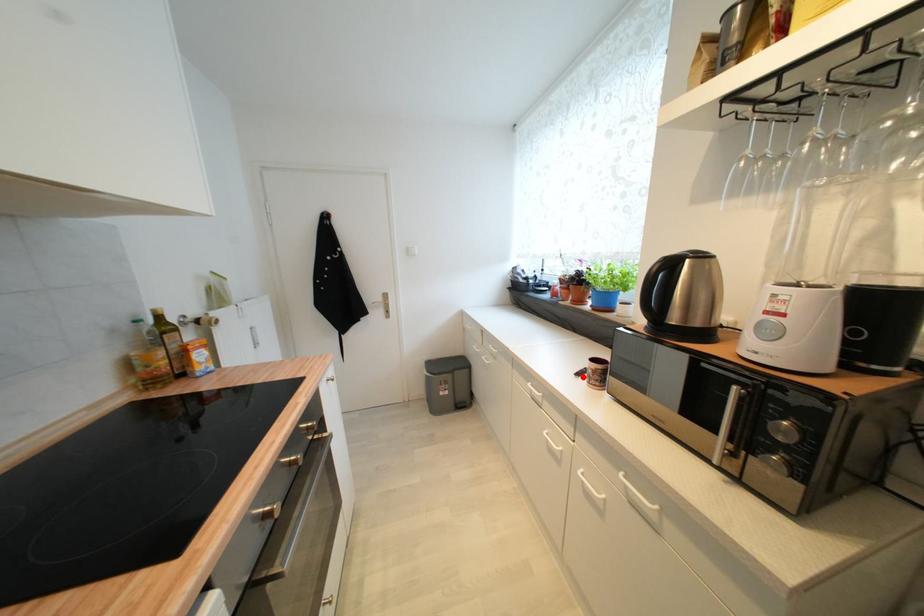
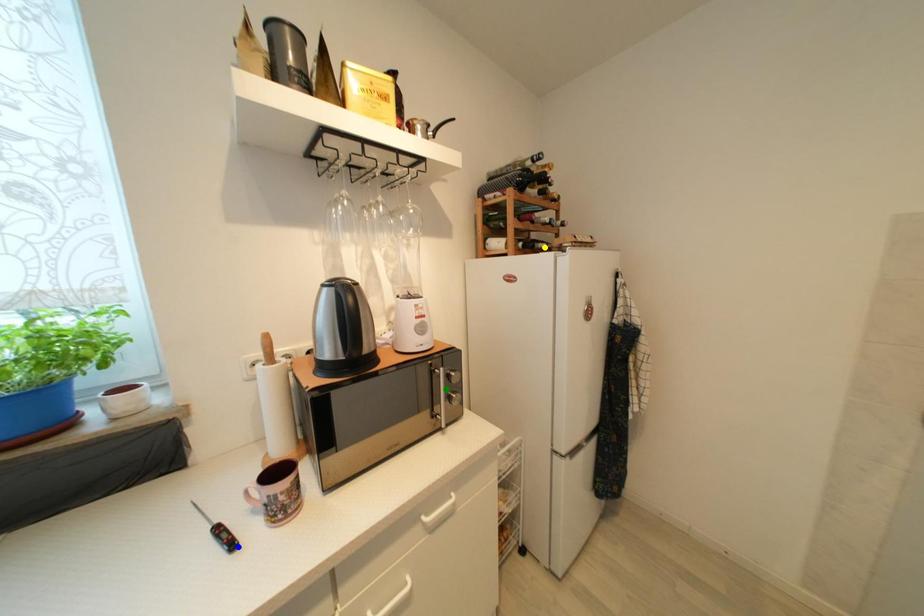
Question: I am providing you with two images of the same scene from different viewpoints. A red point is marked on the first image. You are given multiple points on the second image. Can you choose the point in image 2 that corresponds to the point in image 1?

Choices:
 (A) blue point
 (B) green point
 (C) yellow point

Answer: (A)